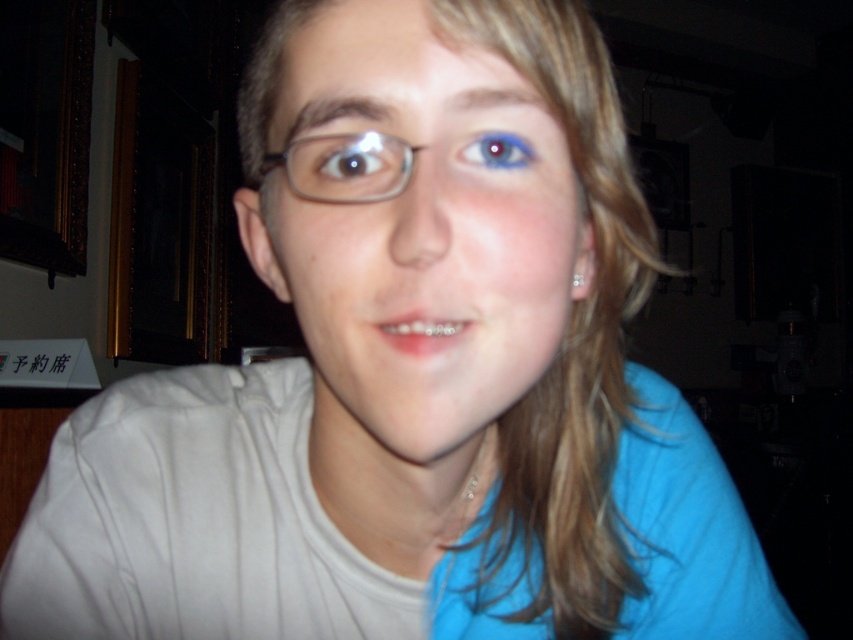
Question: Considering the real-world distances, which object is closest to the matte plastic face at center?

Choices:
 (A) clear plastic glasses at center
 (B) blue matte eye at center
 (C) blue matte eye at upper center

Answer: (A)

Question: Which point is closer to the camera taking this photo?

Choices:
 (A) [376, 250]
 (B) [315, 173]
 (C) [337, 145]
 (D) [511, 157]

Answer: (A)

Question: Considering the relative positions of clear plastic glasses at center and blue matte eye at center in the image provided, where is clear plastic glasses at center located with respect to blue matte eye at center?

Choices:
 (A) right
 (B) left

Answer: (A)

Question: Which object is closer to the camera taking this photo?

Choices:
 (A) blue matte eye at upper center
 (B) clear plastic glasses at center
 (C) matte plastic face at center

Answer: (C)

Question: Does blue matte eye at center appear on the left side of blue matte eye at upper center?

Choices:
 (A) yes
 (B) no

Answer: (A)

Question: Is blue matte eye at center in front of blue matte eye at upper center?

Choices:
 (A) yes
 (B) no

Answer: (A)